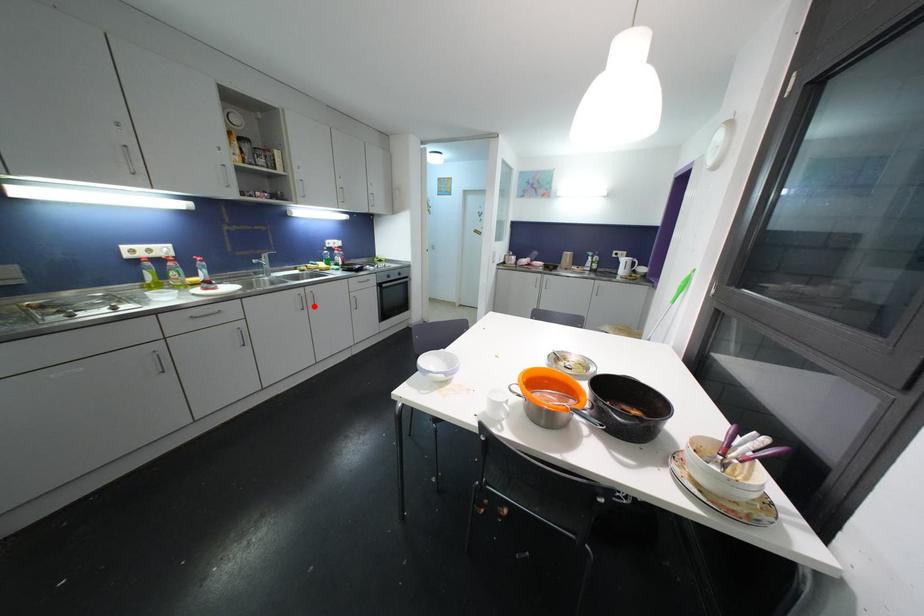
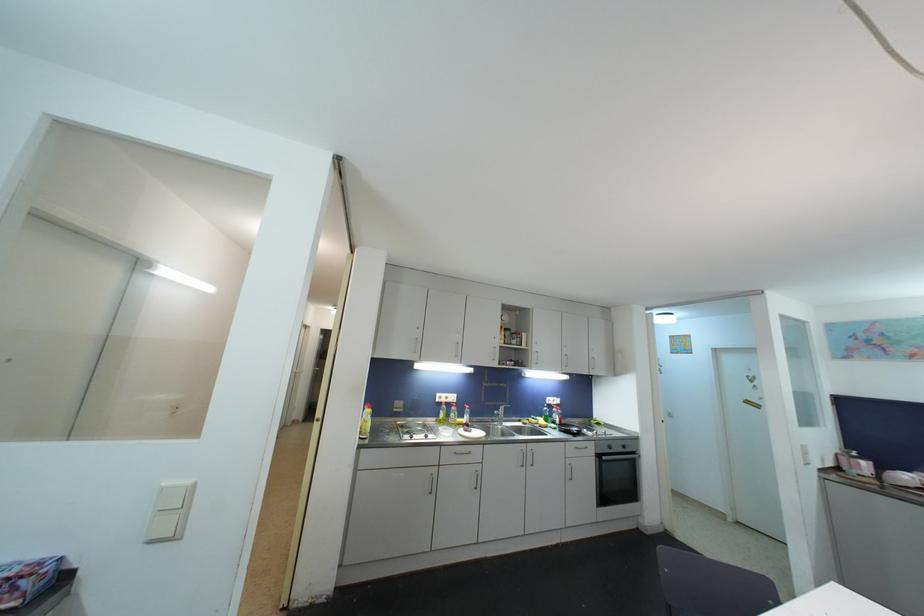
The point at the highlighted location is marked in the first image. Where is the corresponding point in the second image?

(532, 464)